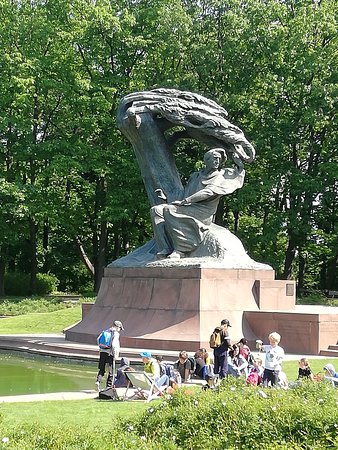
Locate an element on the screen. This screenshot has height=450, width=338. chair is located at coordinates (143, 380).